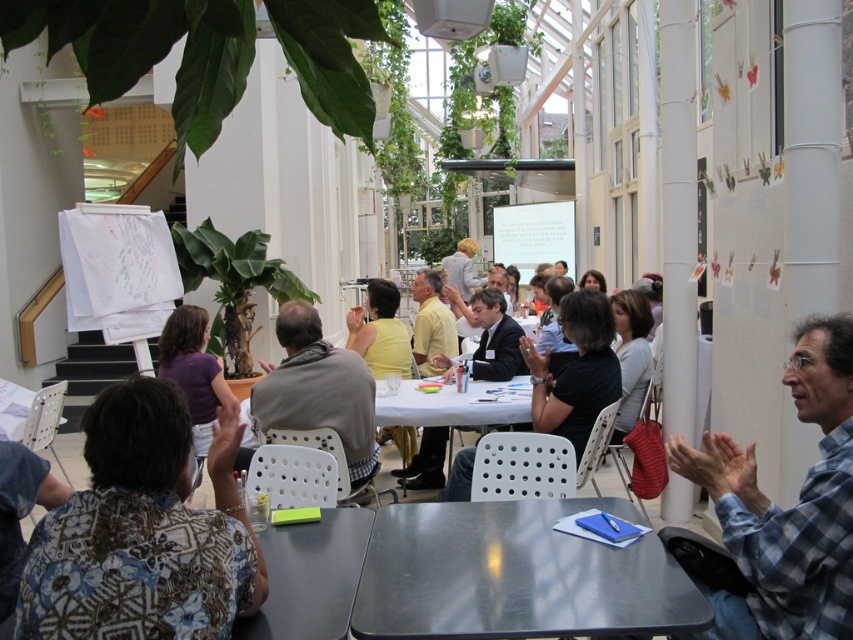
You are a person in the conference room and you want to place your gray fabric jacket at center onto the white plastic table at center. Can you do that without folding the jacket?

The gray fabric jacket at center is taller than the white plastic table at center, so placing it without folding might not be possible due to the height difference.

You are organizing a meeting in this conference room and need to place a name tag for the presenter. The presenter is wearing a black shirt at center. Where should you place the name tag on the white plastic table at center to ensure it is visible from the front of the room?

Since the black shirt at center is to the right of the white plastic table at center, you should place the name tag on the left side of the white plastic table at center so that it is visible from the front where the presenter is standing to the right.

You are standing in the conference room and need to move from the point at coordinates (155, 468) to the point at (558, 388). Which direction should you move to reach your destination?

To move from point (155, 468) to point (558, 388), you should move backward since point (155, 468) is in front of point (558, 388).